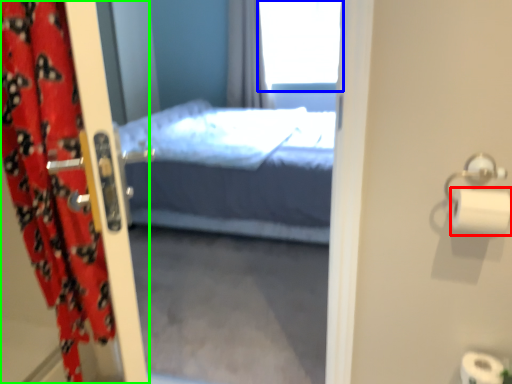
Question: Which object is positioned farthest from toilet paper (highlighted by a red box)? Select from window (highlighted by a blue box) and curtain (highlighted by a green box).

Choices:
 (A) window
 (B) curtain

Answer: (A)